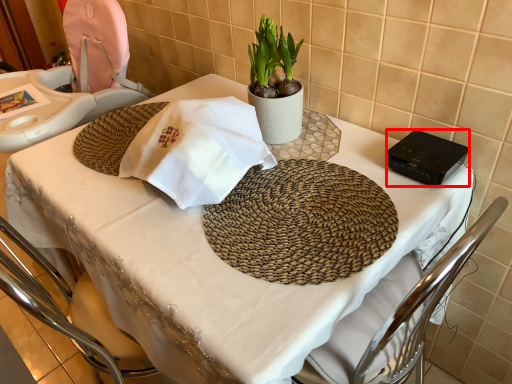
Question: From the image, what is the correct spatial relationship of gadget (annotated by the red box) in relation to houseplant?

Choices:
 (A) left
 (B) right

Answer: (B)